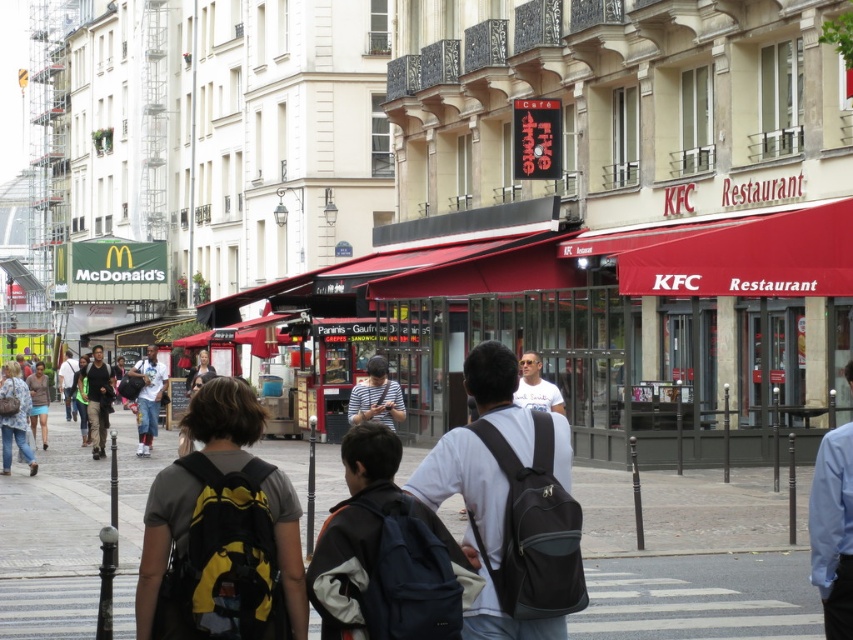
You are standing at the entrance of the McDonalds store on the sidewalk. You see a person wearing a blue shirt at center. In which direction should you walk to reach them?

The blue shirt at center is located at point 0.830 on the x axis and 0.977 on the y axis. Since you are at the entrance of McDonalds, which is on the sidewalk, you should walk forward towards the center of the image to reach the blue shirt at center.

You are a photographer standing at the corner of the street. You want to capture both the blue shirt at center and the light blue denim shorts at lower left in the same frame. Which direction should you move to ensure both are visible?

You should move to the left so that the blue shirt at center and light blue denim shorts at lower left can be captured in the same frame since the blue shirt at center is to the right of the light blue denim shorts at lower left.

You are a photographer trying to capture a candid shot of the striped fabric shirt at center without including the dark gray backpack at center in the frame. Based on their positions, is this possible?

The dark gray backpack at center is positioned on the right side of striped fabric shirt at center. Since the backpack is to the right of the shirt, you can adjust your angle to the left to exclude the backpack while keeping the shirt in the frame.